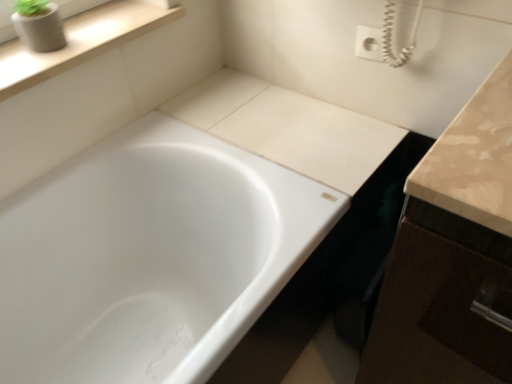
Identify the location of free location to the right of matte gray concrete planter at upper left. (104, 32).